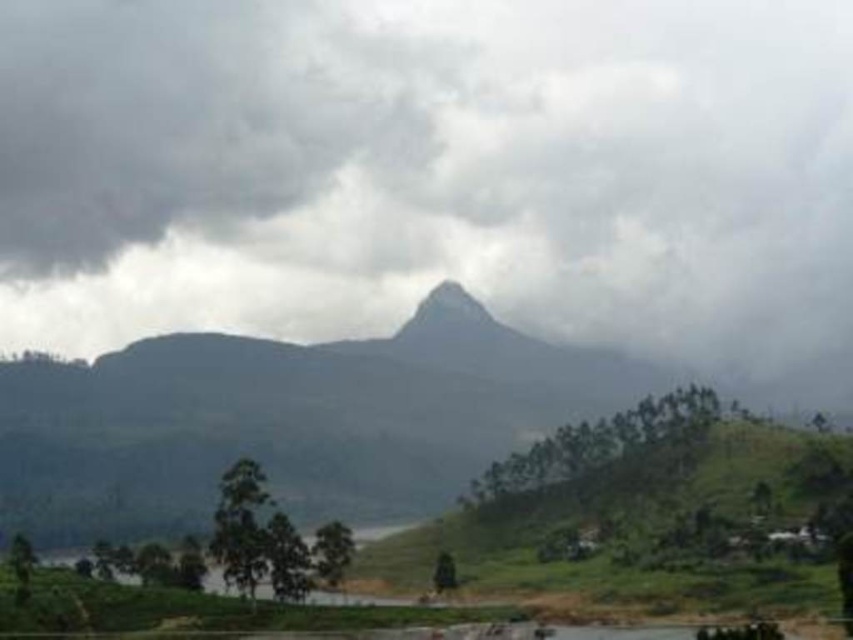
Between gray cloudy sky at center and dark gray rocky mountain at center, which one is positioned higher?

gray cloudy sky at center is above.

Is gray cloudy sky at center bigger than dark gray rocky mountain at center?

Indeed, gray cloudy sky at center has a larger size compared to dark gray rocky mountain at center.

Describe the element at coordinates (434, 173) in the screenshot. I see `gray cloudy sky at center` at that location.

Find the location of `gray cloudy sky at center`. gray cloudy sky at center is located at coordinates (434, 173).